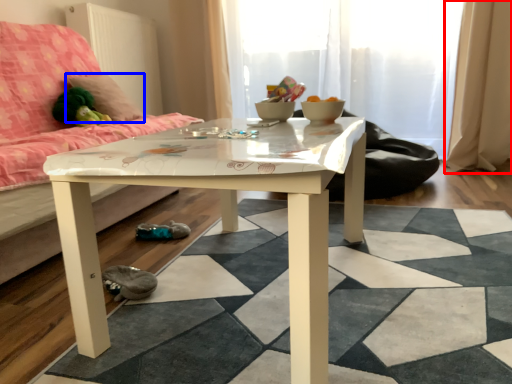
Question: Which object appears farthest to the camera in this image, curtain (highlighted by a red box) or pillow (highlighted by a blue box)?

Choices:
 (A) curtain
 (B) pillow

Answer: (A)